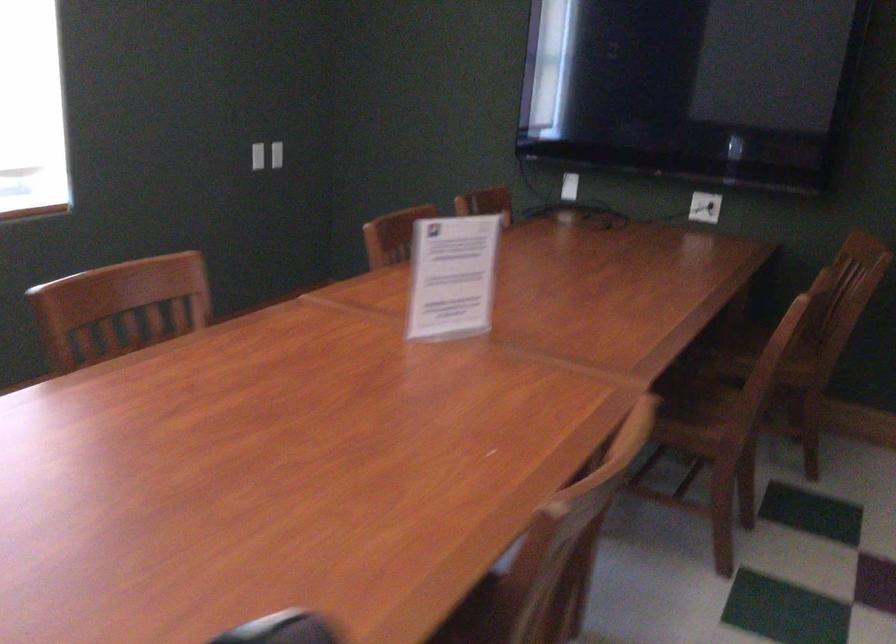
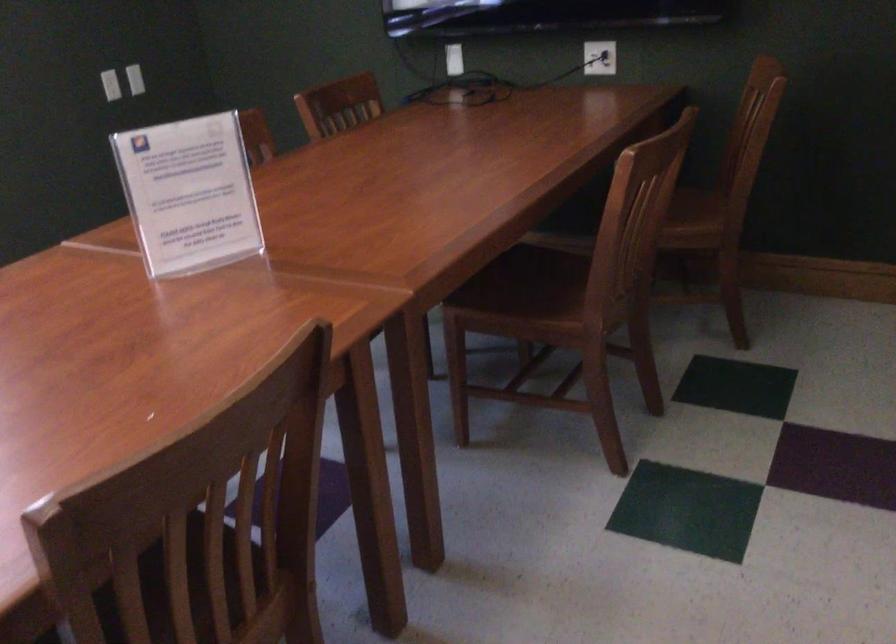
Find the pixel in the second image that matches point (797, 341) in the first image.

(668, 205)